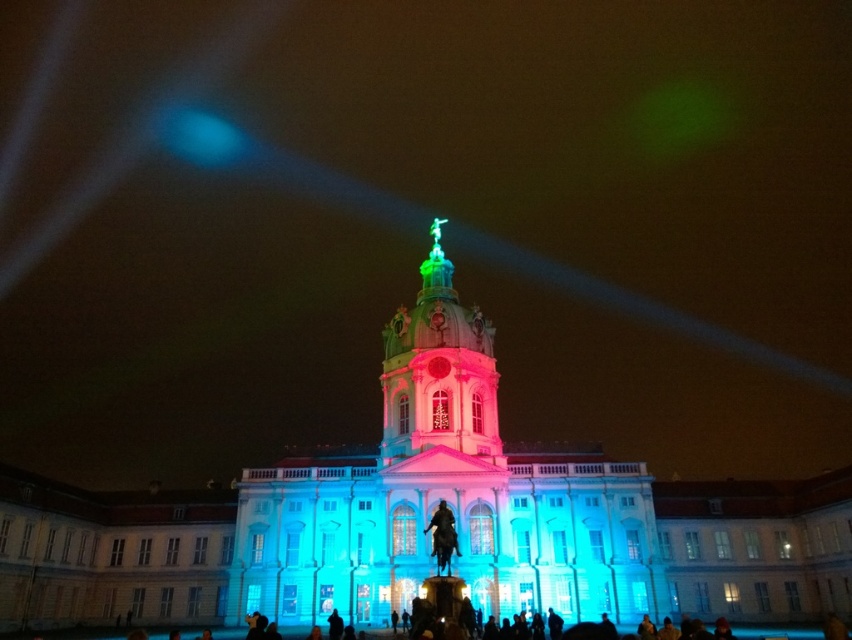
You are a tourist standing in front of the building and want to take a photo that includes both the polished stone tower at center and the shiny green dome at center. Which object should you focus on first to ensure both are in the frame?

You should focus on the polished stone tower at center first since it is closer to you than the shiny green dome at center, allowing both to be captured in the frame.

Looking at this image, you are a photographer planning to capture the polished stone tower at center and the shiny green dome at center in a single frame. Based on their heights, which object should you position closer to the camera to ensure both are fully visible in the photo?

The polished stone tower at center is much taller than the shiny green dome at center, so to capture both fully in the photo, you should position the shiny green dome at center closer to the camera. This way, the shorter dome can be enlarged in the frame to balance the height difference with the taller tower.